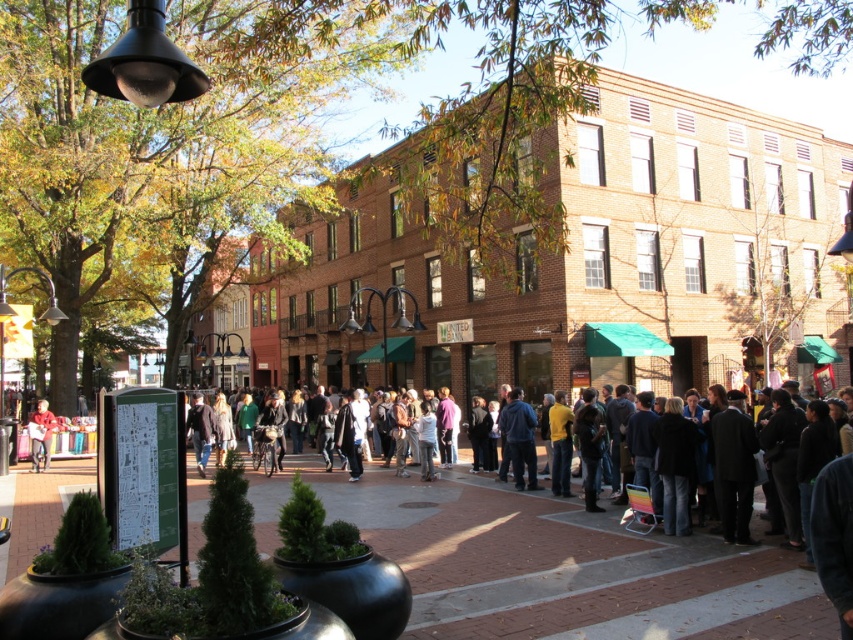
From the picture: Is brick pavement at center below matte black jacket at left?

No.

Between brick pavement at center and matte black jacket at left, which one has less height?

Standing shorter between the two is matte black jacket at left.

Describe the element at coordinates (566, 566) in the screenshot. I see `brick pavement at center` at that location.

This screenshot has height=640, width=853. What are the coordinates of `brick pavement at center` in the screenshot? It's located at (566, 566).